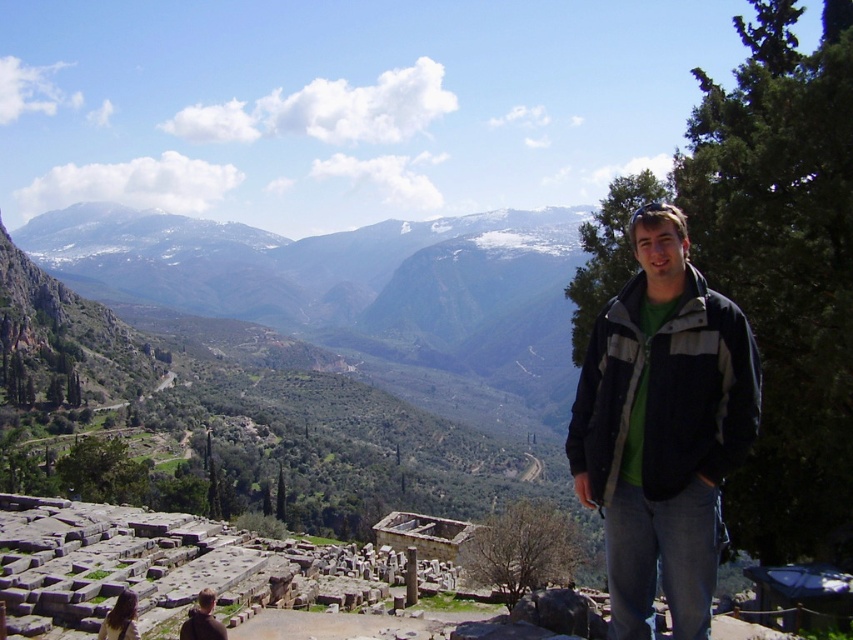
Between dark gray textured jacket at right and brown hair at lower left, which one has less height?

Standing shorter between the two is brown hair at lower left.

Is dark gray textured jacket at right wider than brown hair at lower left?

Indeed, dark gray textured jacket at right has a greater width compared to brown hair at lower left.

Between point (659, 467) and point (200, 620), which one is positioned behind?

The point (200, 620) is behind.

Locate an element on the screen. The image size is (853, 640). dark gray textured jacket at right is located at coordinates (666, 392).